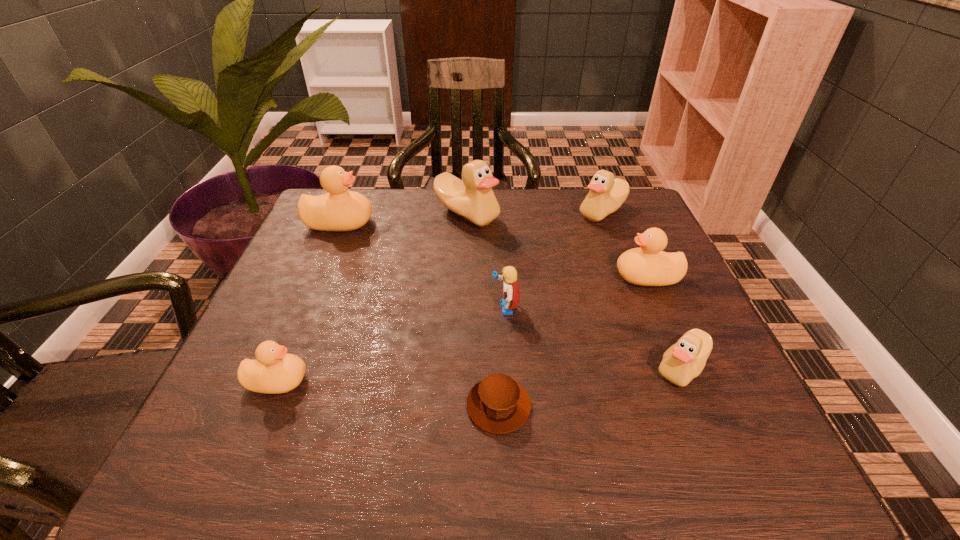
Identify the location of free spot at the far edge of the desktop. (554, 202).

The width and height of the screenshot is (960, 540). I want to click on vacant area at the near edge of the desktop, so click(x=588, y=460).

The width and height of the screenshot is (960, 540). What are the coordinates of `vacant space at the right edge` in the screenshot? It's located at (641, 309).

I want to click on vacant space at the far right corner of the desktop, so pos(625,232).

In the image, there is a desktop. Where is `vacant space at the near right corner`? The image size is (960, 540). vacant space at the near right corner is located at coordinates (670, 431).

Where is `free spot between the smallest yellow duck and the brown muffin`? free spot between the smallest yellow duck and the brown muffin is located at coordinates (388, 393).

This screenshot has height=540, width=960. In order to click on free area in between the fourth duck from right to left and the second smallest beige duck in this screenshot , I will do tap(535, 213).

This screenshot has height=540, width=960. Find the location of `vacant region between the Lego and the leftmost beige duck`. vacant region between the Lego and the leftmost beige duck is located at coordinates (486, 261).

Find the location of a particular element. free spot between the Lego and the rightmost yellow duck is located at coordinates (576, 293).

Identify the location of vacant area that lies between the Lego and the nearest beige duck. (593, 338).